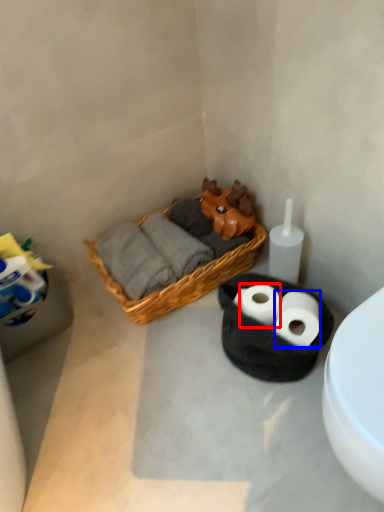
Question: Which of the following is the closest to the observer, toilet paper (highlighted by a red box) or toilet paper (highlighted by a blue box)?

Choices:
 (A) toilet paper
 (B) toilet paper

Answer: (B)